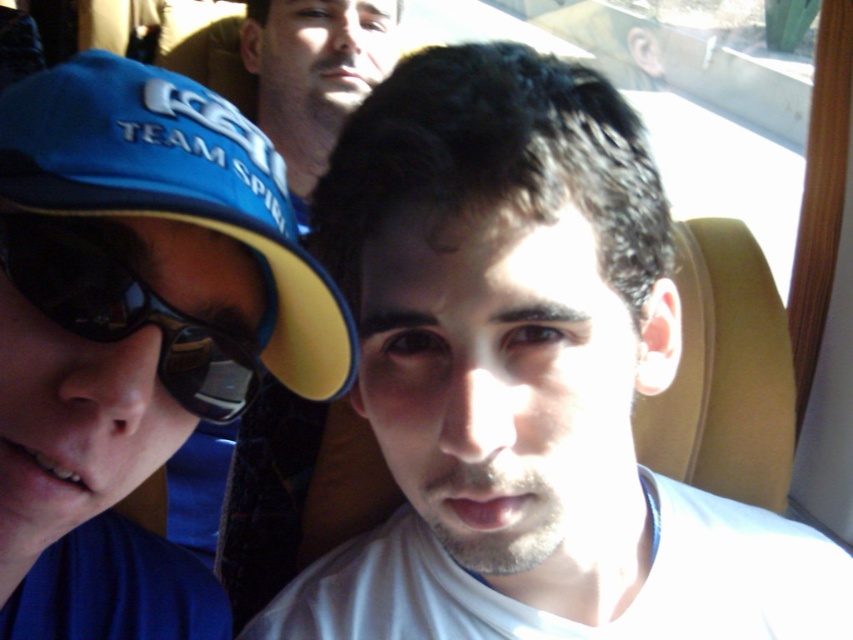
Is white matte shirt at center further to camera compared to black reflective sunglasses at left?

Yes, it is.

Is white matte shirt at center above black reflective sunglasses at left?

Incorrect, white matte shirt at center is not positioned above black reflective sunglasses at left.

Who is more forward, (683, 492) or (252, 342)?

Point (252, 342)

In order to click on white matte shirt at center in this screenshot , I will do `click(521, 376)`.

Who is lower down, black reflective sunglasses at left or matte blue shirt at upper center?

Positioned lower is black reflective sunglasses at left.

What do you see at coordinates (125, 310) in the screenshot?
I see `black reflective sunglasses at left` at bounding box center [125, 310].

Who is more distant from viewer, (158,362) or (263,131)?

The point (263,131) is more distant.

Image resolution: width=853 pixels, height=640 pixels. In order to click on black reflective sunglasses at left in this screenshot , I will do `click(125, 310)`.

Between white matte shirt at center and matte blue shirt at upper center, which one appears on the right side from the viewer's perspective?

white matte shirt at center is more to the right.

Who is more distant from viewer, [506,516] or [300,60]?

The point [300,60] is behind.

Between point (497, 44) and point (286, 58), which one is positioned in front?

Point (497, 44)

This screenshot has height=640, width=853. In order to click on white matte shirt at center in this screenshot , I will do `click(521, 376)`.